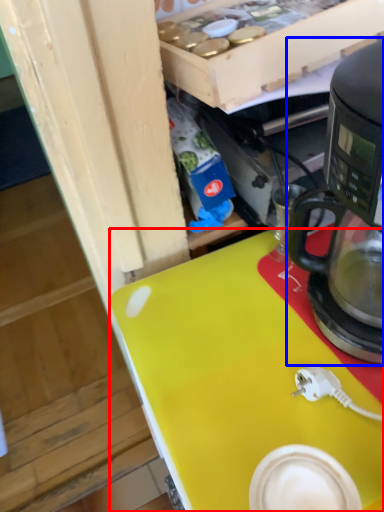
Question: Which object appears closest to the camera in this image, desk (highlighted by a red box) or coffee maker (highlighted by a blue box)?

Choices:
 (A) desk
 (B) coffee maker

Answer: (B)